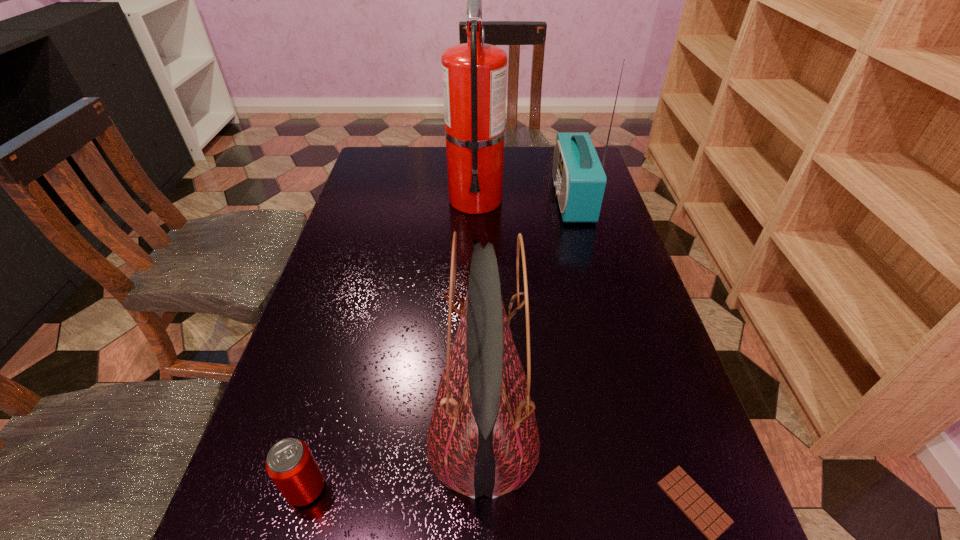
This screenshot has width=960, height=540. I want to click on radio receiver that is positioned at the far edge, so click(578, 176).

Where is `object that is positioned at the left edge`? The height and width of the screenshot is (540, 960). object that is positioned at the left edge is located at coordinates (290, 464).

Identify the location of object that is at the right edge. The height and width of the screenshot is (540, 960). (578, 176).

The width and height of the screenshot is (960, 540). Find the location of `object that is at the far right corner`. object that is at the far right corner is located at coordinates (578, 176).

The height and width of the screenshot is (540, 960). In order to click on vacant position at the far edge of the desktop in this screenshot , I will do `click(513, 173)`.

The image size is (960, 540). What are the coordinates of `free space at the left edge of the desktop` in the screenshot? It's located at (372, 262).

Find the location of a particular element. The width and height of the screenshot is (960, 540). vacant space at the right edge of the desktop is located at coordinates (631, 289).

Where is `free region at the far left corner of the desktop`? The height and width of the screenshot is (540, 960). free region at the far left corner of the desktop is located at coordinates (412, 164).

Where is `vacant region between the fire extinguisher and the second shortest object`? The image size is (960, 540). vacant region between the fire extinguisher and the second shortest object is located at coordinates (391, 344).

You are a GUI agent. You are given a task and a screenshot of the screen. Output one action in this format:
    pyautogui.click(x=<x>, y=<y>)
    Task: Click on the vacant space in between the fourth tallest object and the fire extinguisher
    
    Given the screenshot: What is the action you would take?
    pyautogui.click(x=391, y=344)